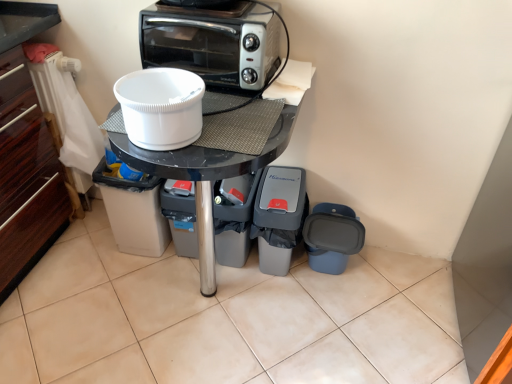
I want to click on free space above blue plastic trash can at lower right, the fifth appliance when ordered from left to right (from a real-world perspective), so click(335, 231).